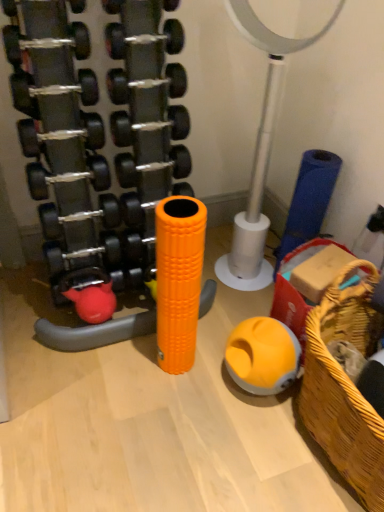
Where is `unoccupied area in front of rubberized yellow ball at center, which appears as the second toy when viewed from the left`? The image size is (384, 512). unoccupied area in front of rubberized yellow ball at center, which appears as the second toy when viewed from the left is located at coordinates (262, 434).